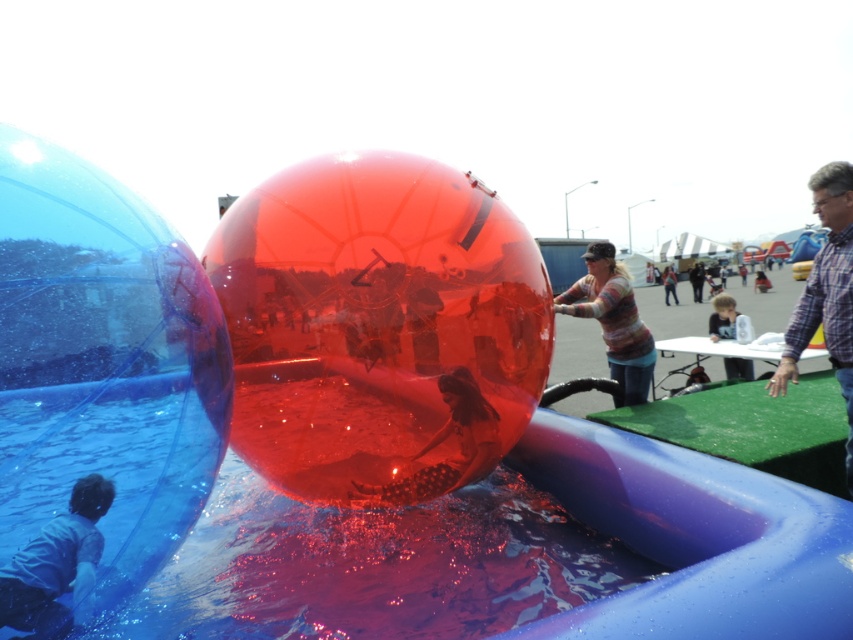
Is plaid shirt at right in front of striped sweater at center?

Yes, it is in front of striped sweater at center.

Who is positioned more to the left, plaid shirt at right or striped sweater at center?

striped sweater at center is more to the left.

This screenshot has height=640, width=853. I want to click on plaid shirt at right, so click(827, 292).

Measure the distance between plaid shirt at right and denim jacket at center.

plaid shirt at right and denim jacket at center are 24.81 meters apart.

Is plaid shirt at right further to camera compared to denim jacket at center?

No.

Which is behind, point (817, 264) or point (660, 276)?

Positioned behind is point (660, 276).

You are a GUI agent. You are given a task and a screenshot of the screen. Output one action in this format:
    pyautogui.click(x=<x>, y=<y>)
    Task: Click on the plaid shirt at right
    The height and width of the screenshot is (640, 853).
    Given the screenshot: What is the action you would take?
    pyautogui.click(x=827, y=292)

Who is higher up, plaid shirt at right or smooth skin child at center?

smooth skin child at center

Between plaid shirt at right and smooth skin child at center, which one has less height?

smooth skin child at center is shorter.

Describe the element at coordinates (827, 292) in the screenshot. I see `plaid shirt at right` at that location.

Image resolution: width=853 pixels, height=640 pixels. I want to click on plaid shirt at right, so click(x=827, y=292).